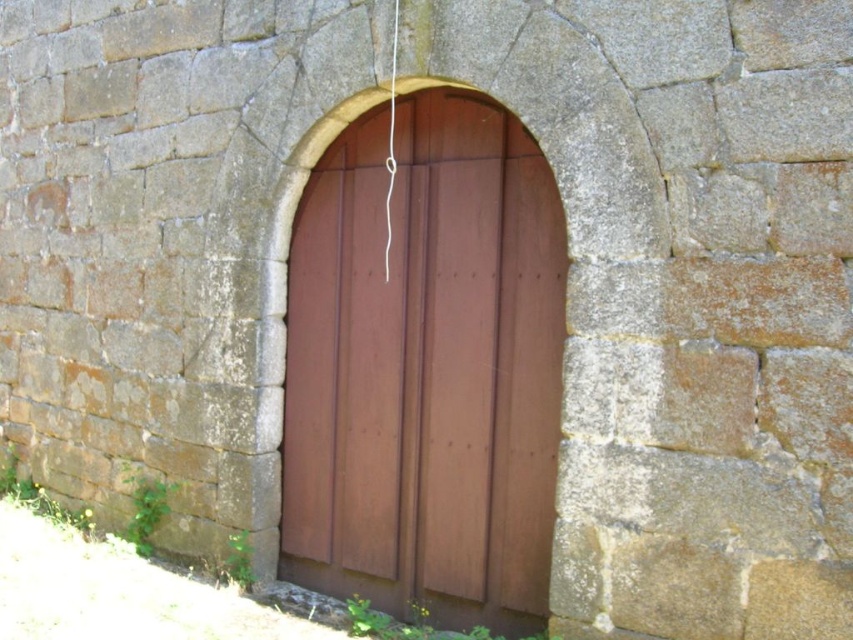
Question: Is brown wooden door at center further to camera compared to white string at center?

Choices:
 (A) no
 (B) yes

Answer: (A)

Question: Does brown wooden door at center have a greater width compared to white string at center?

Choices:
 (A) yes
 (B) no

Answer: (A)

Question: Is the position of brown wooden door at center more distant than that of white string at center?

Choices:
 (A) no
 (B) yes

Answer: (A)

Question: Among these objects, which one is nearest to the camera?

Choices:
 (A) brown wooden door at center
 (B) white string at center

Answer: (A)